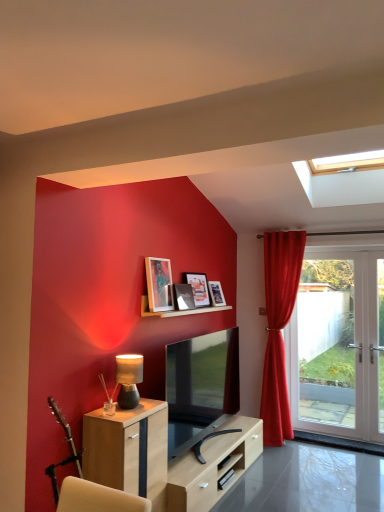
Where is `free space in front of matte black table lamp at lower left`? free space in front of matte black table lamp at lower left is located at coordinates pos(119,411).